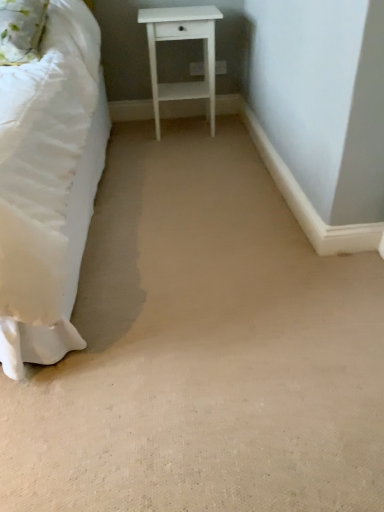
Question: Is fluffy white pillow at upper left at the back of white matte nightstand at center?

Choices:
 (A) yes
 (B) no

Answer: (B)

Question: Is white matte nightstand at center directly adjacent to fluffy white pillow at upper left?

Choices:
 (A) no
 (B) yes

Answer: (A)

Question: Is white matte nightstand at center shorter than fluffy white pillow at upper left?

Choices:
 (A) yes
 (B) no

Answer: (B)

Question: Does white matte nightstand at center appear on the right side of fluffy white pillow at upper left?

Choices:
 (A) yes
 (B) no

Answer: (A)

Question: Is white matte nightstand at center bigger than fluffy white pillow at upper left?

Choices:
 (A) no
 (B) yes

Answer: (B)

Question: Can you confirm if white matte nightstand at center is thinner than fluffy white pillow at upper left?

Choices:
 (A) yes
 (B) no

Answer: (A)

Question: From the image's perspective, is fluffy white pillow at upper left above white matte nightstand at center?

Choices:
 (A) no
 (B) yes

Answer: (A)

Question: Is fluffy white pillow at upper left thinner than white matte nightstand at center?

Choices:
 (A) no
 (B) yes

Answer: (A)

Question: Can you confirm if fluffy white pillow at upper left is bigger than white matte nightstand at center?

Choices:
 (A) yes
 (B) no

Answer: (B)

Question: Can you confirm if fluffy white pillow at upper left is taller than white matte nightstand at center?

Choices:
 (A) no
 (B) yes

Answer: (A)

Question: Is fluffy white pillow at upper left oriented away from white matte nightstand at center?

Choices:
 (A) no
 (B) yes

Answer: (A)

Question: Can you confirm if fluffy white pillow at upper left is shorter than white matte nightstand at center?

Choices:
 (A) yes
 (B) no

Answer: (A)

Question: From a real-world perspective, is white matte nightstand at center physically located above or below fluffy white pillow at upper left?

Choices:
 (A) below
 (B) above

Answer: (A)